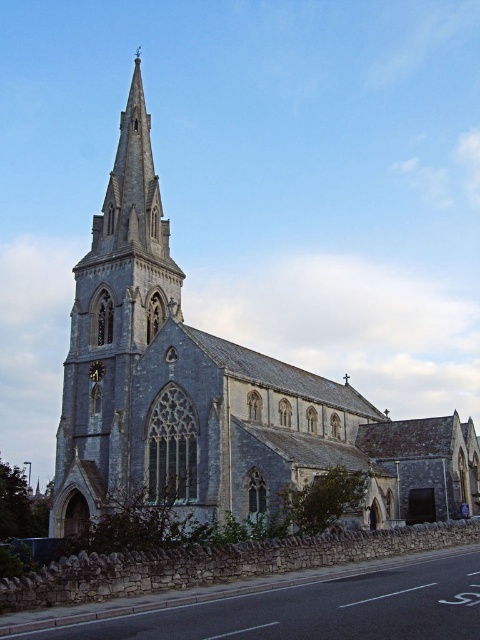
Question: Which point is farther from the camera taking this photo?

Choices:
 (A) (409, 420)
 (B) (90, 378)

Answer: (A)

Question: Does gray stone church at center appear on the left side of dark brown wooden clock at lower left?

Choices:
 (A) no
 (B) yes

Answer: (A)

Question: Which object is closer to the camera taking this photo?

Choices:
 (A) dark brown wooden clock at lower left
 (B) gray stone church at center

Answer: (B)

Question: Which point appears closest to the camera in this image?

Choices:
 (A) pos(96,362)
 (B) pos(168,387)

Answer: (B)

Question: Does gray stone church at center appear under dark brown wooden clock at lower left?

Choices:
 (A) yes
 (B) no

Answer: (B)

Question: Does gray stone church at center appear under dark brown wooden clock at lower left?

Choices:
 (A) yes
 (B) no

Answer: (B)